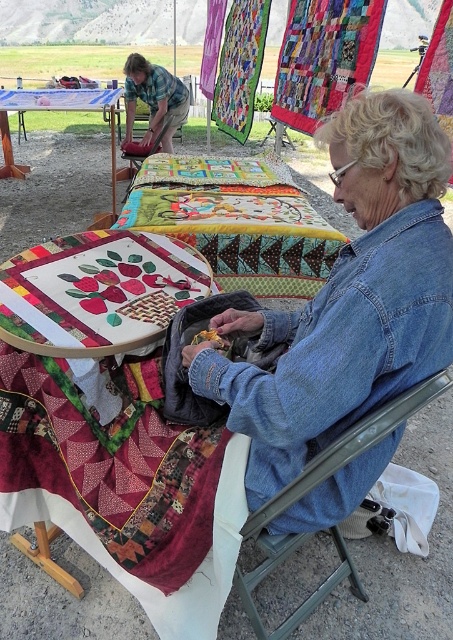
You are standing at the origin point in the image. Which of the two points, point (94,340) or point (106,106), is closer to you?

Point (94,340) is in front of point (106,106), so it is closer to you.

You are a photographer standing 35 inches away from the denim jacket at lower right. Can you comfortably take a photo of the jacket without moving closer?

The denim jacket at lower right and viewer are 35.22 inches apart, so yes, you can comfortably take a photo of the denim jacket at lower right without moving closer since the distance is just over 35 inches.

You are a photographer standing at the center of the scene. You want to place a spotlight at the exact center of the scene. Will the denim jacket at lower right be illuminated by the spotlight?

The denim jacket at lower right is located at point [348,298], which is not the center of the scene. Therefore, the spotlight placed at the exact center will not illuminate the denim jacket at lower right.